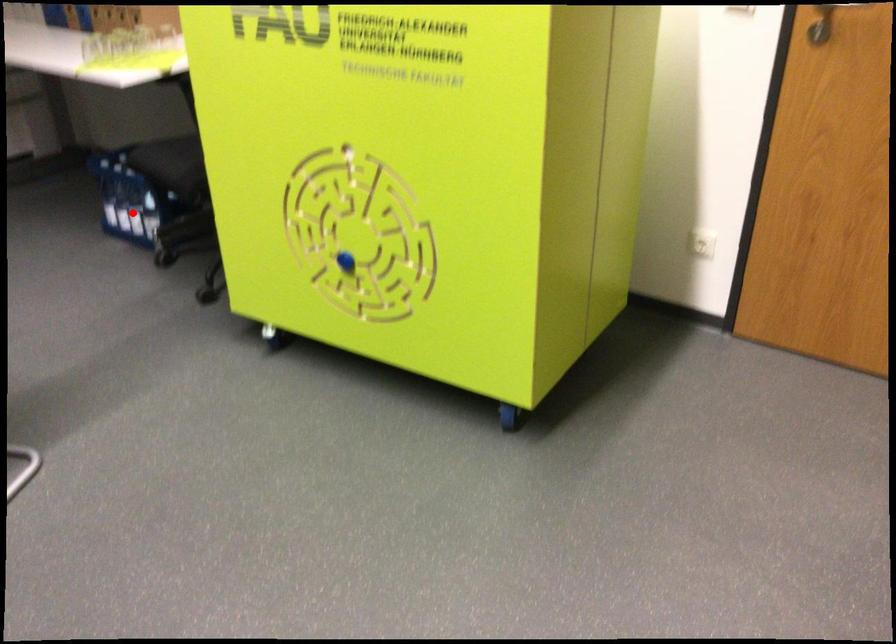
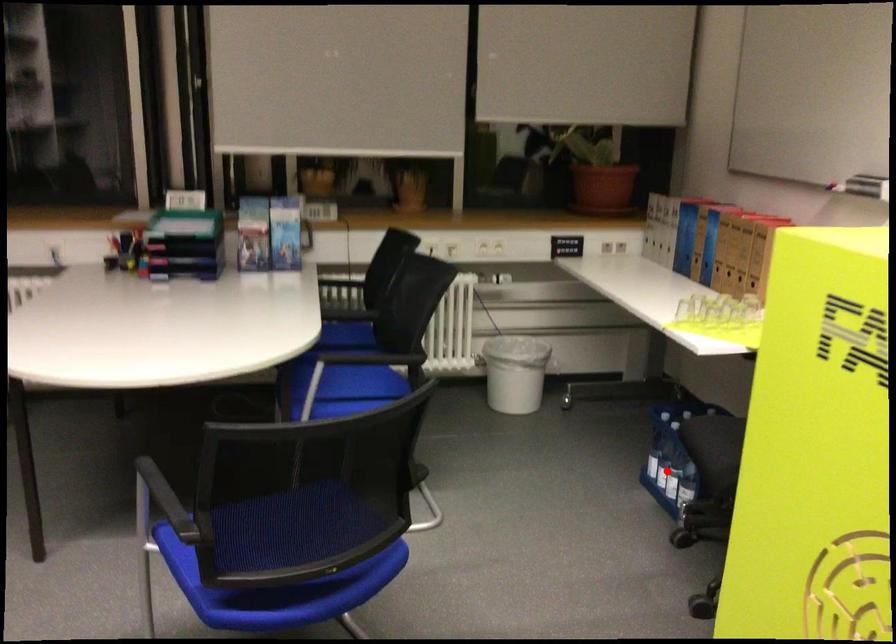
Consider the image. I am providing you with two images of the same scene from different viewpoints. A red point is marked on the first image and another point is marked on the second image. Are the points marked in image1 and image2 representing the same 3D position?

Yes